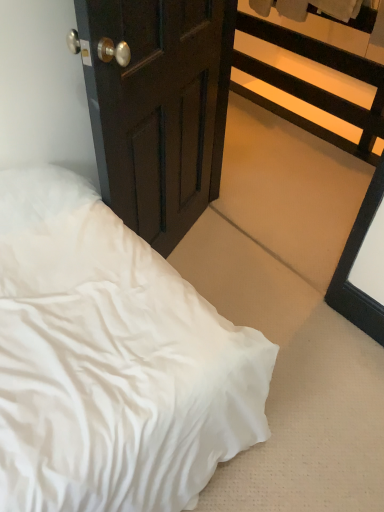
Where is `white satin bed at lower left`? white satin bed at lower left is located at coordinates (111, 361).

The image size is (384, 512). What do you see at coordinates (314, 85) in the screenshot? I see `black wood balustrade at upper right` at bounding box center [314, 85].

Where is `white satin bed at lower left`? white satin bed at lower left is located at coordinates (111, 361).

Is black wood balustrade at upper right completely or partially inside white satin bed at lower left?

No, white satin bed at lower left does not contain black wood balustrade at upper right.

Considering the positions of points (183, 422) and (278, 72), is point (183, 422) farther from camera compared to point (278, 72)?

That is False.

From the image's perspective, is white satin bed at lower left located above or below black wood balustrade at upper right?

Based on their image positions, white satin bed at lower left is located beneath black wood balustrade at upper right.

Which object is thinner, white satin bed at lower left or black wood balustrade at upper right?

Thinner between the two is black wood balustrade at upper right.

Is white satin bed at lower left taller or shorter than dark wood door at center?

Clearly, white satin bed at lower left is shorter compared to dark wood door at center.

Does white satin bed at lower left lie behind dark wood door at center?

Yes, white satin bed at lower left is behind dark wood door at center.

In the scene shown: Is white satin bed at lower left inside or outside of dark wood door at center?

white satin bed at lower left is not inside dark wood door at center, it's outside.

Is black wood balustrade at upper right next to white satin bed at lower left and touching it?

They are not placed beside each other.

Identify the location of bed below the black wood balustrade at upper right (from the image's perspective). Image resolution: width=384 pixels, height=512 pixels. (111, 361).

Which object is closer to the camera taking this photo, black wood balustrade at upper right or white satin bed at lower left?

white satin bed at lower left is more forward.

Which is more to the left, black wood balustrade at upper right or white satin bed at lower left?

Positioned to the left is white satin bed at lower left.

Can you confirm if dark wood door at center is shorter than white satin bed at lower left?

Incorrect, the height of dark wood door at center does not fall short of that of white satin bed at lower left.

From a real-world perspective, which is physically below, dark wood door at center or white satin bed at lower left?

In real-world perspective, white satin bed at lower left is lower.

Can you confirm if dark wood door at center is bigger than white satin bed at lower left?

Yes, dark wood door at center is bigger than white satin bed at lower left.

Which is in front, dark wood door at center or black wood balustrade at upper right?

dark wood door at center is in front.

Which of these two, dark wood door at center or black wood balustrade at upper right, stands taller?

dark wood door at center.

Between dark wood door at center and black wood balustrade at upper right, which one has smaller width?

With smaller width is dark wood door at center.

Is dark wood door at center located outside black wood balustrade at upper right?

Absolutely, dark wood door at center is external to black wood balustrade at upper right.

How far apart are black wood balustrade at upper right and dark wood door at center?

black wood balustrade at upper right and dark wood door at center are 4.14 feet apart from each other.

Considering the relative sizes of black wood balustrade at upper right and dark wood door at center in the image provided, is black wood balustrade at upper right smaller than dark wood door at center?

Incorrect, black wood balustrade at upper right is not smaller in size than dark wood door at center.

Is dark wood door at center inside black wood balustrade at upper right?

No, dark wood door at center is not inside black wood balustrade at upper right.

Where is `balustrade above the white satin bed at lower left (from the image's perspective)`? Image resolution: width=384 pixels, height=512 pixels. balustrade above the white satin bed at lower left (from the image's perspective) is located at coordinates (314, 85).

At what (x,y) coordinates should I click in order to perform the action: click on bed on the right of the dark wood door at center. Please return your answer as a coordinate pair (x, y). Looking at the image, I should click on (111, 361).

When comparing their distances from white satin bed at lower left, does black wood balustrade at upper right or dark wood door at center seem closer?

The object closer to white satin bed at lower left is dark wood door at center.

Considering their positions, is dark wood door at center positioned further to white satin bed at lower left than black wood balustrade at upper right?

black wood balustrade at upper right lies further to white satin bed at lower left than the other object.

Estimate the real-world distances between objects in this image. Which object is further from dark wood door at center, white satin bed at lower left or black wood balustrade at upper right?

Based on the image, black wood balustrade at upper right appears to be further to dark wood door at center.

Estimate the real-world distances between objects in this image. Which object is closer to black wood balustrade at upper right, dark wood door at center or white satin bed at lower left?

dark wood door at center.

From the image, which object appears to be nearer to black wood balustrade at upper right, white satin bed at lower left or dark wood door at center?

Based on the image, dark wood door at center appears to be nearer to black wood balustrade at upper right.

Looking at the image, which one is located closer to dark wood door at center, black wood balustrade at upper right or white satin bed at lower left?

white satin bed at lower left.

Find the location of `door between black wood balustrade at upper right and white satin bed at lower left from top to bottom`. door between black wood balustrade at upper right and white satin bed at lower left from top to bottom is located at coordinates (158, 108).